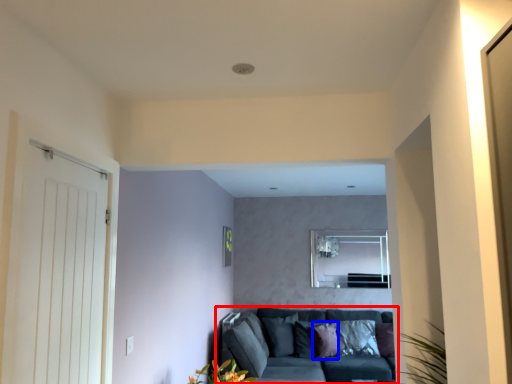
Question: Which of the following is the farthest to the observer, studio couch (highlighted by a red box) or pillow (highlighted by a blue box)?

Choices:
 (A) studio couch
 (B) pillow

Answer: (B)